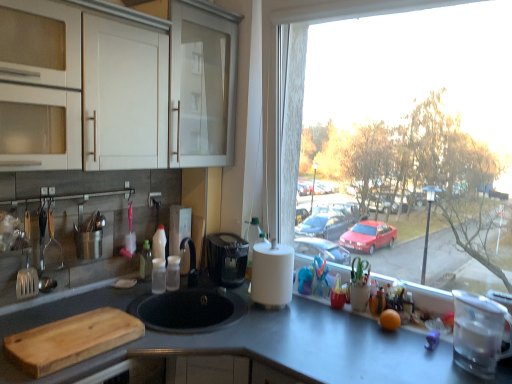
Measure the distance between transparent glass water filter at right, which is counted as the 1th appliance, starting from the front, and camera.

1.41 meters.

Describe the element at coordinates (72, 340) in the screenshot. This screenshot has height=384, width=512. I see `wooden cutting board at lower left` at that location.

This screenshot has width=512, height=384. What do you see at coordinates (272, 274) in the screenshot? I see `white matte paper towel at center` at bounding box center [272, 274].

Describe the element at coordinates (146, 261) in the screenshot. I see `transparent plastic bottle at sink` at that location.

Measure the distance between metallic spatula at left and camera.

metallic spatula at left and camera are 5.64 feet apart from each other.

Image resolution: width=512 pixels, height=384 pixels. Describe the element at coordinates (31, 280) in the screenshot. I see `metallic spatula at left` at that location.

Image resolution: width=512 pixels, height=384 pixels. Identify the location of satin nickel faucet at center, which appears as the first appliance when viewed from the back. pos(180,234).

Can you confirm if transparent plastic bottle at sink is wider than wooden cutting board at lower left?

In fact, transparent plastic bottle at sink might be narrower than wooden cutting board at lower left.

Would you say transparent plastic bottle at sink is inside or outside wooden cutting board at lower left?

transparent plastic bottle at sink cannot be found inside wooden cutting board at lower left.

Who is taller, transparent plastic bottle at sink or wooden cutting board at lower left?

With more height is transparent plastic bottle at sink.

From a real-world perspective, is metallic spatula at left on top of white glossy cabinet at upper left?

Actually, metallic spatula at left is physically below white glossy cabinet at upper left in the real world.

Which object is closer to the camera, metallic spatula at left or white glossy cabinet at upper left?

metallic spatula at left is closer to the camera.

From the image's perspective, between metallic spatula at left and white glossy cabinet at upper left, which one is located above?

white glossy cabinet at upper left.

Which is more to the left, metallic spatula at left or white glossy cabinet at upper left?

metallic spatula at left.

From the image's perspective, would you say white glossy cabinet at upper left is shown under satin nickel faucet at center, which appears as the first appliance when viewed from the back?

Actually, white glossy cabinet at upper left appears above satin nickel faucet at center, which appears as the first appliance when viewed from the back, in the image.

Considering the relative sizes of white glossy cabinet at upper left and satin nickel faucet at center, placed as the second appliance when sorted from right to left, in the image provided, is white glossy cabinet at upper left shorter than satin nickel faucet at center, placed as the second appliance when sorted from right to left,?

No, white glossy cabinet at upper left is not shorter than satin nickel faucet at center, placed as the second appliance when sorted from right to left.

In the image, is white glossy cabinet at upper left positioned in front of or behind satin nickel faucet at center, positioned as the 1th appliance in left-to-right order?

white glossy cabinet at upper left is in front of satin nickel faucet at center, positioned as the 1th appliance in left-to-right order.

Measure the distance from transparent plastic bottle at sink to satin nickel faucet at center, which appears as the first appliance when viewed from the back.

A distance of 6.87 inches exists between transparent plastic bottle at sink and satin nickel faucet at center, which appears as the first appliance when viewed from the back.

Are transparent plastic bottle at sink and satin nickel faucet at center, positioned as the 1th appliance in left-to-right order, making contact?

No, transparent plastic bottle at sink is not next to satin nickel faucet at center, positioned as the 1th appliance in left-to-right order.

From the image's perspective, which object appears higher, transparent plastic bottle at sink or satin nickel faucet at center, positioned as the 1th appliance in left-to-right order?

satin nickel faucet at center, positioned as the 1th appliance in left-to-right order, appears higher in the image.

Could you tell me if transparent plastic bottle at sink is turned towards satin nickel faucet at center, which appears as the first appliance when viewed from the back?

No, transparent plastic bottle at sink is not oriented towards satin nickel faucet at center, which appears as the first appliance when viewed from the back.

Is white glossy cabinet at upper left in front of white matte paper towel at center?

Yes, it is.

Is white glossy cabinet at upper left oriented towards white matte paper towel at center?

No.

From a real-world perspective, which object rests below the other?

transparent glass water filter at right, the 1th appliance from the right, from a real-world perspective.

What are the coordinates of `cabinetry above the transparent glass water filter at right, the 1th appliance from the right (from the image's perspective)` in the screenshot? It's located at (86, 85).

In the image, is white glossy cabinet at upper left positioned in front of or behind transparent glass water filter at right, which is counted as the 1th appliance, starting from the front?

Visually, white glossy cabinet at upper left is located in front of transparent glass water filter at right, which is counted as the 1th appliance, starting from the front.

Which object is thinner, white glossy cabinet at upper left or transparent glass window at right?

Thinner between the two is transparent glass window at right.

Which is more to the left, white glossy cabinet at upper left or transparent glass window at right?

white glossy cabinet at upper left.

Find the location of a particular element. The width and height of the screenshot is (512, 384). bottle behind the wooden cutting board at lower left is located at coordinates (146, 261).

This screenshot has width=512, height=384. Identify the location of silverware located below the white glossy cabinet at upper left (from the image's perspective). (31, 280).

Based on their spatial positions, is metallic spatula at left or wooden cutting board at lower left further from transparent plastic bottle at sink?

wooden cutting board at lower left is positioned further to the anchor transparent plastic bottle at sink.

Based on their spatial positions, is transparent glass water filter at right, acting as the second appliance starting from the left, or white glossy cabinet at upper left further from white matte paper towel at center?

Among the two, white glossy cabinet at upper left is located further to white matte paper towel at center.

Considering their positions, is wooden cutting board at lower left positioned further to metallic spatula at left than smooth gray countertop at center?

smooth gray countertop at center is positioned further to the anchor metallic spatula at left.

Looking at the image, which one is located closer to metallic spatula at left, smooth gray countertop at center or white glossy cabinet at upper left?

white glossy cabinet at upper left is positioned closer to the anchor metallic spatula at left.

Considering their positions, is transparent glass water filter at right, the 1th appliance from the right, positioned closer to white matte paper towel at center than satin nickel faucet at center, placed as the second appliance when sorted from right to left?

The object closer to white matte paper towel at center is satin nickel faucet at center, placed as the second appliance when sorted from right to left.

Looking at the image, which one is located further to transparent glass window at right, white glossy cabinet at upper left or transparent plastic bottle at sink?

transparent plastic bottle at sink.

From the image, which object appears to be nearer to transparent glass window at right, white glossy cabinet at upper left or white matte paper towel at center?

Among the two, white matte paper towel at center is located nearer to transparent glass window at right.

Considering their positions, is metallic spatula at left positioned further to white glossy cabinet at upper left than wooden cutting board at lower left?

wooden cutting board at lower left lies further to white glossy cabinet at upper left than the other object.

Locate an element on the screen. cabinetry between metallic spatula at left and white matte paper towel at center is located at coordinates (86, 85).

Where is `screen door between transparent plastic bottle at sink and transparent glass window at right from left to right`? Image resolution: width=512 pixels, height=384 pixels. screen door between transparent plastic bottle at sink and transparent glass window at right from left to right is located at coordinates (202, 84).

You are a GUI agent. You are given a task and a screenshot of the screen. Output one action in this format:
    pyautogui.click(x=<x>, y=<y>)
    Task: Click on the bottle located between wooden cutting board at lower left and satin nickel faucet at center, placed as the second appliance when sorted from front to back, in the depth direction
    This screenshot has height=384, width=512.
    Given the screenshot: What is the action you would take?
    pyautogui.click(x=146, y=261)

Locate an element on the screen. paper towel between white glossy cabinet at upper left and wooden cutting board at lower left vertically is located at coordinates (272, 274).